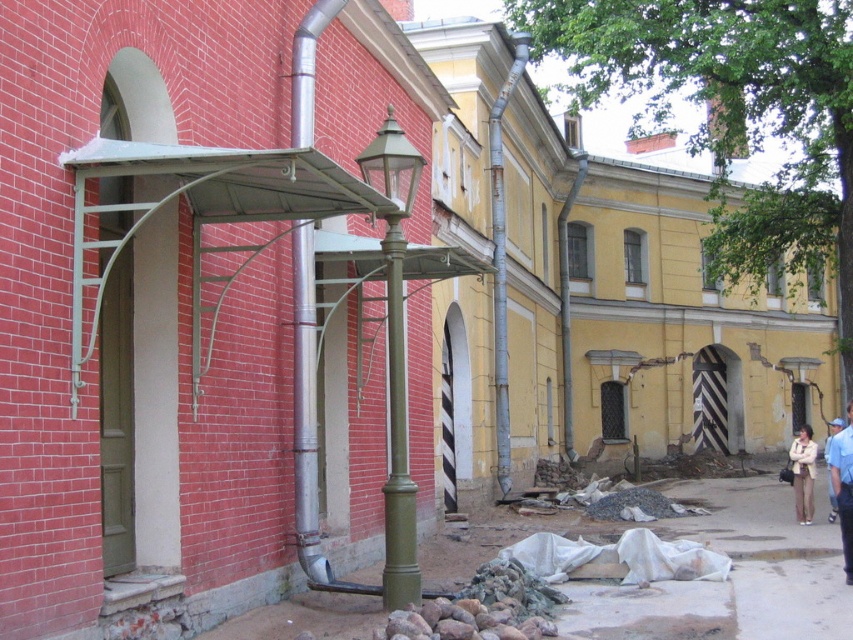
Question: Which point appears closest to the camera in this image?

Choices:
 (A) (798, 492)
 (B) (399, 352)
 (C) (807, 586)

Answer: (B)

Question: Is smooth concrete pavement at lower center positioned before light blue uniform at lower right?

Choices:
 (A) yes
 (B) no

Answer: (A)

Question: Which is nearer to the smooth concrete pavement at lower center?

Choices:
 (A) green polished metal pole at center
 (B) light blue uniform at lower right

Answer: (B)

Question: Does smooth concrete pavement at lower center appear over light blue uniform at lower right?

Choices:
 (A) no
 (B) yes

Answer: (A)

Question: Estimate the real-world distances between objects in this image. Which object is farther from the green polished metal pole at center?

Choices:
 (A) smooth concrete pavement at lower center
 (B) light blue uniform at lower right
 (C) light beige fabric coat at lower right

Answer: (C)

Question: Can you confirm if green polished metal pole at center is positioned above light blue uniform at lower right?

Choices:
 (A) yes
 (B) no

Answer: (A)